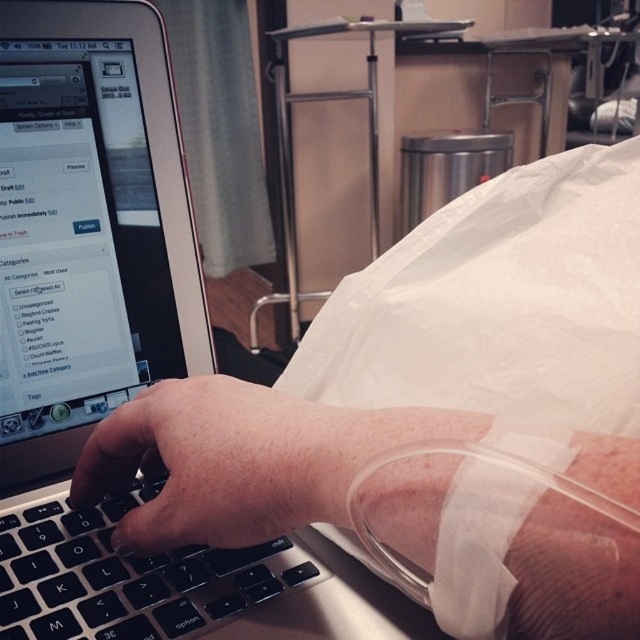
You are a nurse in a hospital room. You need to retrieve a medical device from the patient. The device is attached to the patient and is located at point 0.506, 0.155. You see the sleek silver laptop at center. Where is the device located relative to the laptop?

The device is attached to the patient and located at the same position as the sleek silver laptop at center, which is at point (99, 323).

You are a healthcare worker checking the patient in the hospital room. You notice the skinny white hand at center and the black matte keyboard at center. Which object is directly above the other?

The skinny white hand at center is positioned over the black matte keyboard at center, so the hand is directly above the keyboard.

You are a nurse in a hospital room. You need to check two points on a patient. The points are labeled as point (195, 384) and point (243, 401). Which point is closer to you?

Point (195, 384) is further to the viewer than point (243, 401), so the point closer to you is point (243, 401).